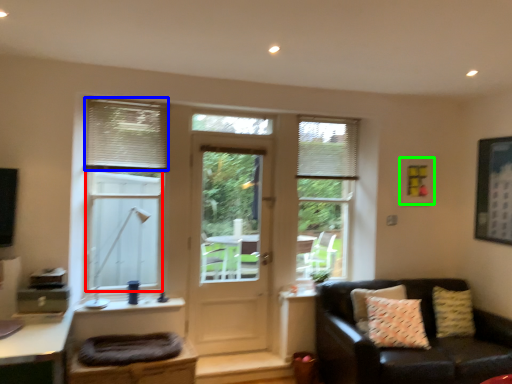
Question: Which object is the farthest from bay window (highlighted by a red box)? Choose among these: shutter (highlighted by a blue box) or picture frame (highlighted by a green box).

Choices:
 (A) shutter
 (B) picture frame

Answer: (B)